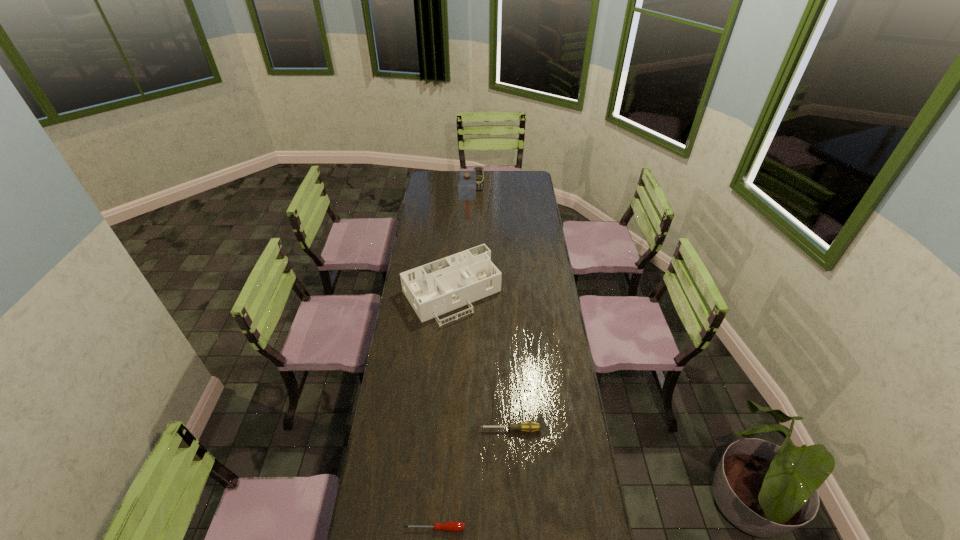
Where is `the tallest object`? the tallest object is located at coordinates (467, 179).

Locate an element on the screen. This screenshot has height=540, width=960. mallet is located at coordinates (467, 179).

Identify the location of cellular telephone. (479, 171).

Where is `the farthest object`? This screenshot has height=540, width=960. the farthest object is located at coordinates (479, 171).

Where is `dollhouse`? This screenshot has width=960, height=540. dollhouse is located at coordinates (433, 289).

Identify the location of the third farthest object. The image size is (960, 540). point(433,289).

Find the location of a particular element. Image resolution: width=960 pixels, height=540 pixels. the right screwdriver is located at coordinates (529, 426).

Where is `the fourth farthest object`? the fourth farthest object is located at coordinates (529, 426).

At what (x,y) coordinates should I click in order to perform the action: click on the shorter screwdriver. Please return your answer as a coordinate pair (x, y). Looking at the image, I should click on point(455,526).

Where is `the left screwdriver`? The height and width of the screenshot is (540, 960). the left screwdriver is located at coordinates (455, 526).